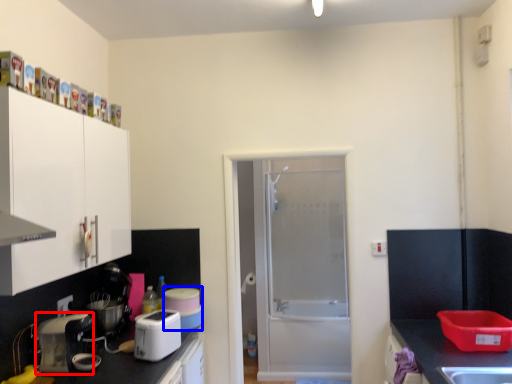
Question: Which object is further to the camera taking this photo, kitchen appliance (highlighted by a red box) or appliance (highlighted by a blue box)?

Choices:
 (A) kitchen appliance
 (B) appliance

Answer: (B)